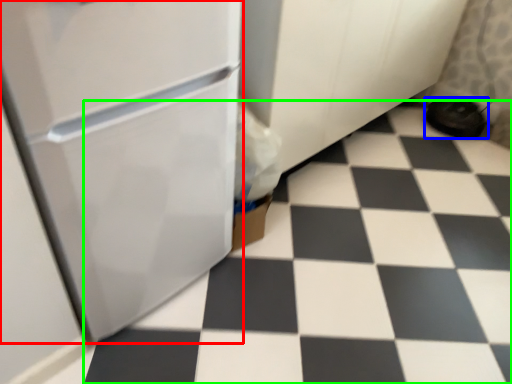
Question: Which object is positioned farthest from refrigerator (highlighted by a red box)? Select from footwear (highlighted by a blue box) and tile (highlighted by a green box).

Choices:
 (A) footwear
 (B) tile

Answer: (A)